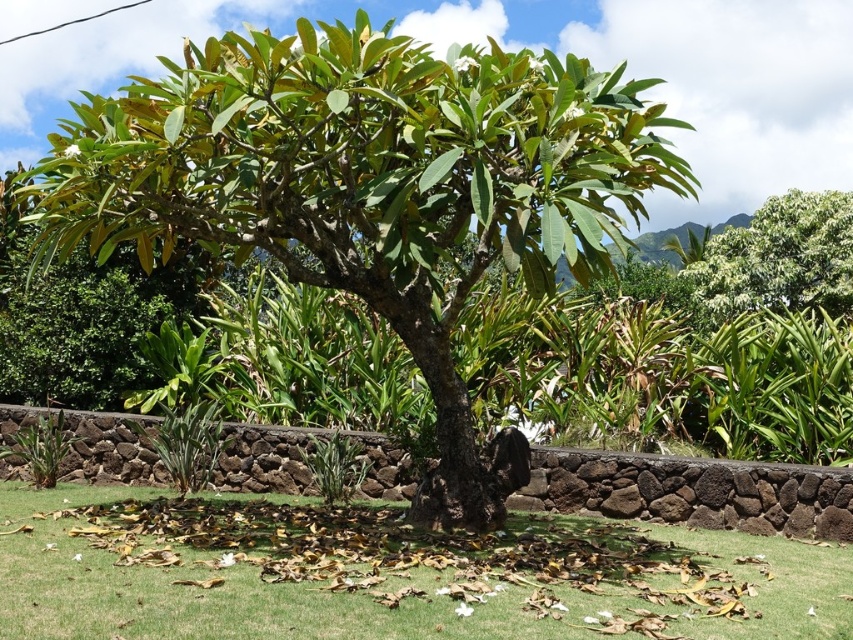
You are a gardener standing in the tropical garden scene. You need to water both the green leafy tree at center and the green leafy tree at upper right. Which tree should you water first if you want to start from the leftmost tree in the scene?

You should water the green leafy tree at center first because it is positioned to the left of the green leafy tree at upper right, making it the leftmost tree in the scene.

You are a gardener who wants to plant a new flower bed between the green leafy tree at center and the green grass at center. Based on their positions, where should you place the flower bed?

The green leafy tree at center is above the green grass at center, so the flower bed should be placed between them in the middle ground area, below the tree and above the grass.